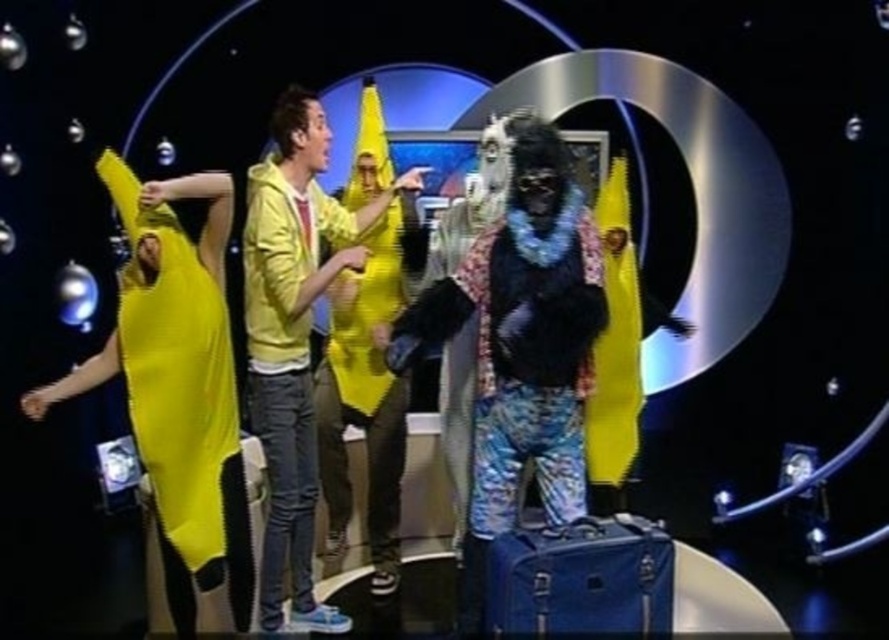
Question: Where is yellow matte banana at center located in relation to yellow fabric dress at center in the image?

Choices:
 (A) above
 (B) below

Answer: (B)

Question: Is blue fabric suitcase at center positioned before matte yellow banana at center?

Choices:
 (A) yes
 (B) no

Answer: (A)

Question: Which of the following is the closest to the observer?

Choices:
 (A) rubberized yellow banana at left
 (B) fuzzy black costume at center

Answer: (A)

Question: Which object is farther from the camera taking this photo?

Choices:
 (A) yellow matte banana at center
 (B) rubberized yellow banana at left
 (C) yellow fabric dress at center
 (D) blue fabric suitcase at center

Answer: (C)

Question: Among these points, which one is nearest to the camera?

Choices:
 (A) (565, 588)
 (B) (598, 365)
 (C) (378, 259)
 (D) (319, 138)

Answer: (A)

Question: Can you confirm if rubberized yellow banana at left is positioned to the right of yellow fabric dress at center?

Choices:
 (A) no
 (B) yes

Answer: (A)